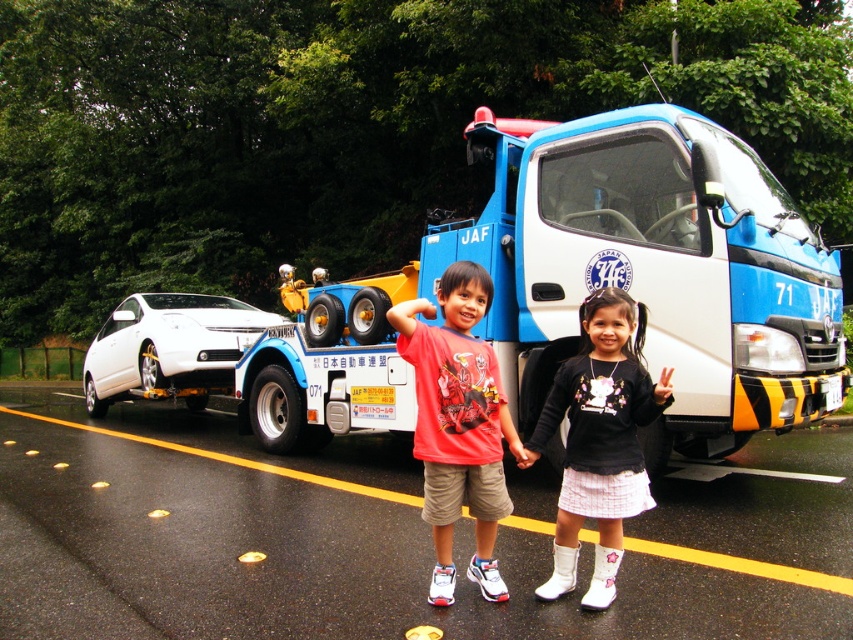
Question: Does blue metallic tow truck at center lie in front of matte red t-shirt at center?

Choices:
 (A) yes
 (B) no

Answer: (B)

Question: Which point is farther from the camera taking this photo?

Choices:
 (A) (468, 458)
 (B) (531, 461)
 (C) (271, 417)

Answer: (C)

Question: Which object is the closest to the matte red t-shirt at center?

Choices:
 (A) blue metallic tow truck at center
 (B) black matte sweater at center
 (C) matte red shirt at center

Answer: (C)

Question: Which point is farther to the camera?

Choices:
 (A) black matte sweater at center
 (B) matte red t-shirt at center

Answer: (B)

Question: Does blue metallic tow truck at center appear over white glossy car at left?

Choices:
 (A) no
 (B) yes

Answer: (B)

Question: Does blue metallic tow truck at center appear on the right side of matte red shirt at center?

Choices:
 (A) no
 (B) yes

Answer: (B)